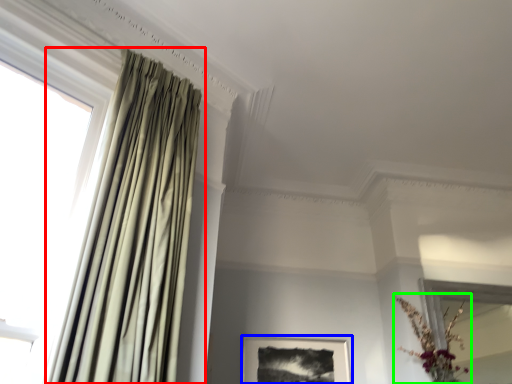
Question: Which object is the farthest from curtain (highlighted by a red box)? Choose among these: picture frame (highlighted by a blue box) or floral arrangement (highlighted by a green box).

Choices:
 (A) picture frame
 (B) floral arrangement

Answer: (B)